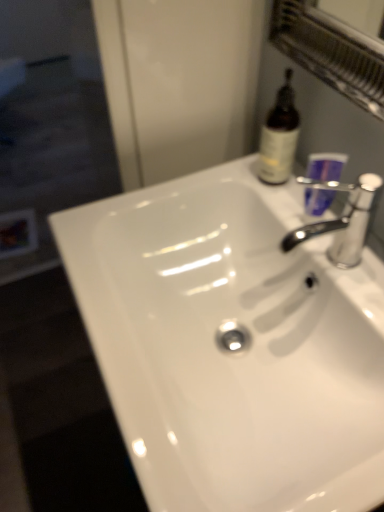
Question: Does transparent glass screen door at left come behind silver metallic faucet at upper right?

Choices:
 (A) yes
 (B) no

Answer: (A)

Question: Can you confirm if transparent glass screen door at left is smaller than silver metallic faucet at upper right?

Choices:
 (A) yes
 (B) no

Answer: (B)

Question: Is silver metallic faucet at upper right inside transparent glass screen door at left?

Choices:
 (A) yes
 (B) no

Answer: (B)

Question: Can you confirm if transparent glass screen door at left is bigger than silver metallic faucet at upper right?

Choices:
 (A) yes
 (B) no

Answer: (A)

Question: Can you confirm if transparent glass screen door at left is positioned to the right of silver metallic faucet at upper right?

Choices:
 (A) yes
 (B) no

Answer: (B)

Question: Can you confirm if transparent glass screen door at left is thinner than silver metallic faucet at upper right?

Choices:
 (A) no
 (B) yes

Answer: (A)

Question: From a real-world perspective, is silver metallic faucet at upper right physically below transparent glass screen door at left?

Choices:
 (A) yes
 (B) no

Answer: (B)

Question: Does silver metallic faucet at upper right have a lesser height compared to transparent glass screen door at left?

Choices:
 (A) no
 (B) yes

Answer: (A)

Question: Is silver metallic faucet at upper right turned away from transparent glass screen door at left?

Choices:
 (A) yes
 (B) no

Answer: (B)

Question: Considering the relative positions of silver metallic faucet at upper right and transparent glass screen door at left in the image provided, is silver metallic faucet at upper right to the left of transparent glass screen door at left from the viewer's perspective?

Choices:
 (A) yes
 (B) no

Answer: (B)

Question: Is silver metallic faucet at upper right completely or partially outside of transparent glass screen door at left?

Choices:
 (A) no
 (B) yes

Answer: (B)

Question: Does silver metallic faucet at upper right have a smaller size compared to transparent glass screen door at left?

Choices:
 (A) no
 (B) yes

Answer: (B)

Question: Would you say transparent glass screen door at left contains purple plastic cup at upper right?

Choices:
 (A) no
 (B) yes

Answer: (A)